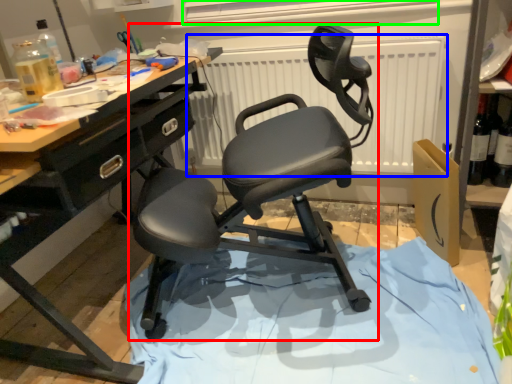
Question: Which object is the farthest from chair (highlighted by a red box)? Choose among these: radiator (highlighted by a blue box) or window screen (highlighted by a green box).

Choices:
 (A) radiator
 (B) window screen

Answer: (B)